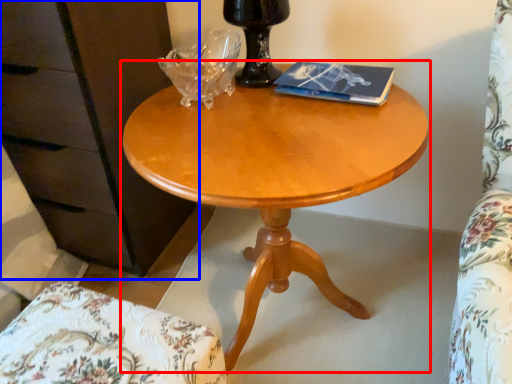
Question: Which of the following is the farthest to the observer, coffee table (highlighted by a red box) or dresser (highlighted by a blue box)?

Choices:
 (A) coffee table
 (B) dresser

Answer: (B)